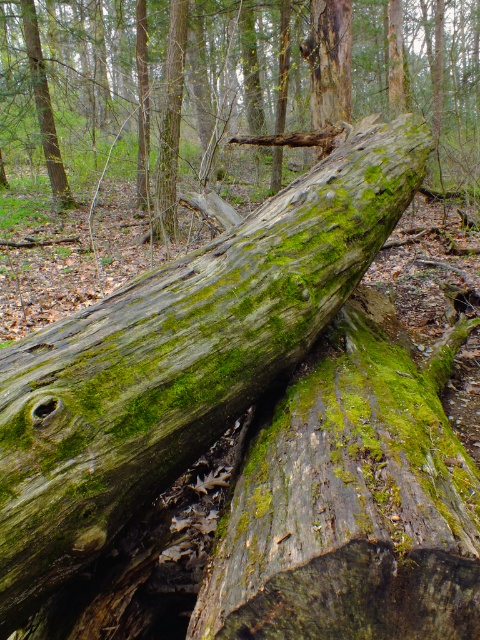
Can you confirm if green mossy wood log at center is thinner than green mossy wood at center?

No.

Is point (314, 244) closer to camera compared to point (345, 380)?

No, it is behind (345, 380).

The height and width of the screenshot is (640, 480). I want to click on green mossy wood log at center, so click(180, 356).

Looking at this image, which is below, green mossy wood at center or green mossy log at center?

Positioned lower is green mossy wood at center.

Is green mossy wood at center to the left of green mossy log at center from the viewer's perspective?

In fact, green mossy wood at center is to the right of green mossy log at center.

The height and width of the screenshot is (640, 480). What are the coordinates of `green mossy wood at center` in the screenshot? It's located at click(350, 499).

Based on the photo, which is below, green mossy wood log at center or green mossy log at center?

green mossy wood log at center

You are a GUI agent. You are given a task and a screenshot of the screen. Output one action in this format:
    pyautogui.click(x=<x>, y=<y>)
    Task: Click on the green mossy wood log at center
    The image size is (480, 640).
    Given the screenshot: What is the action you would take?
    pyautogui.click(x=180, y=356)